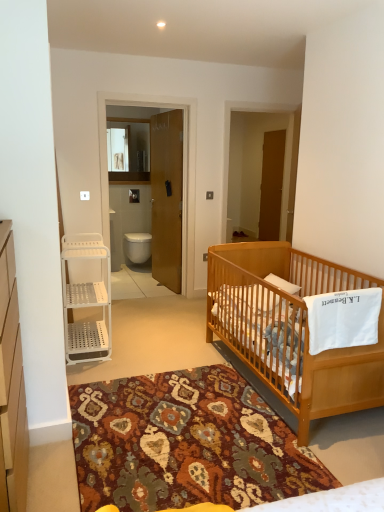
Image resolution: width=384 pixels, height=512 pixels. Find the location of `patterned carpet at center`. patterned carpet at center is located at coordinates (185, 443).

What do you see at coordinates (271, 185) in the screenshot?
I see `brown wooden screen door at center` at bounding box center [271, 185].

In order to face brown wooden door at center, should I rotate leftwards or rightwards?

Rotate left and turn 3.873 degrees.

Where is `patterned carpet at center`? This screenshot has height=512, width=384. patterned carpet at center is located at coordinates [185, 443].

Identify the location of shelf below the brown wooden door at center (from the image's perspective). The image size is (384, 512). (86, 300).

From the image's perspective, is brown wooden door at center positioned above or below white plastic shelf at left?

Based on their image positions, brown wooden door at center is located above white plastic shelf at left.

Which is behind, point (164, 204) or point (64, 242)?

The point (164, 204) is more distant.

Considering the relative sizes of white glossy toilet at center and patterned carpet at center in the image provided, is white glossy toilet at center wider than patterned carpet at center?

In fact, white glossy toilet at center might be narrower than patterned carpet at center.

Can you tell me how much white glossy toilet at center and patterned carpet at center differ in facing direction?

white glossy toilet at center and patterned carpet at center are facing 179 degrees away from each other.

Considering the relative sizes of white glossy toilet at center and patterned carpet at center in the image provided, is white glossy toilet at center smaller than patterned carpet at center?

Correct, white glossy toilet at center occupies less space than patterned carpet at center.

Is patterned carpet at center at the back of white glossy toilet at center?

white glossy toilet at center does not have its back to patterned carpet at center.

From a real-world perspective, is white plastic shelving unit at left positioned over brown wooden door at center based on gravity?

No, from a real-world perspective, white plastic shelving unit at left is not above brown wooden door at center.

Which is more to the left, white plastic shelving unit at left or brown wooden door at center?

From the viewer's perspective, white plastic shelving unit at left appears more on the left side.

How many degrees apart are the facing directions of white plastic shelving unit at left and brown wooden door at center?

172 degrees.

Is white plastic shelving unit at left next to brown wooden door at center?

No, white plastic shelving unit at left is not with brown wooden door at center.

Is light brown wooden crib at lower right looking in the opposite direction of brown wooden door at center?

No, light brown wooden crib at lower right is not facing the opposite direction of brown wooden door at center.

Considering the positions of point (324, 273) and point (169, 266), is point (324, 273) closer or farther from the camera than point (169, 266)?

Clearly, point (324, 273) is closer to the camera than point (169, 266).

From a real-world perspective, relative to brown wooden door at center, is light brown wooden crib at lower right vertically above or below?

In terms of real-world spatial position, light brown wooden crib at lower right is below brown wooden door at center.

Can you confirm if light brown wooden crib at lower right is positioned to the right of brown wooden door at center?

Yes.

Which is behind, brown wooden door at center or brown wooden screen door at center?

brown wooden screen door at center is further from the camera.

Measure the distance between brown wooden door at center and brown wooden screen door at center.

brown wooden door at center and brown wooden screen door at center are 1.89 meters apart from each other.

From their relative heights in the image, would you say brown wooden door at center is taller or shorter than brown wooden screen door at center?

Clearly, brown wooden door at center is taller compared to brown wooden screen door at center.

Is brown wooden door at center looking in the opposite direction of brown wooden screen door at center?

No, brown wooden door at center's orientation is not away from brown wooden screen door at center.

Does white plastic shelving unit at left come in front of white glossy toilet at center?

Yes, it is.

Is white plastic shelving unit at left beside white glossy toilet at center?

They are not placed beside each other.

Is white plastic shelving unit at left to the right of white glossy toilet at center from the viewer's perspective?

In fact, white plastic shelving unit at left is to the left of white glossy toilet at center.

From a real-world perspective, relative to patterned carpet at center, is brown wooden door at center vertically above or below?

In terms of real-world spatial position, brown wooden door at center is above patterned carpet at center.

Is brown wooden door at center bigger or smaller than patterned carpet at center?

In the image, brown wooden door at center appears to be smaller than patterned carpet at center.

Is there a large distance between brown wooden door at center and patterned carpet at center?

Yes, brown wooden door at center is far from patterned carpet at center.

Where is `door on the right side of white plastic shelf at left`? This screenshot has height=512, width=384. door on the right side of white plastic shelf at left is located at coordinates click(167, 197).

This screenshot has height=512, width=384. I want to click on mat located below the white glossy toilet at center (from the image's perspective), so click(185, 443).

Estimate the real-world distances between objects in this image. Which object is further from brown wooden screen door at center, patterned carpet at center or brown wooden door at center?

The object further to brown wooden screen door at center is patterned carpet at center.

Based on their spatial positions, is white plastic shelf at left or brown wooden screen door at center further from white plastic shelving unit at left?

brown wooden screen door at center.

Estimate the real-world distances between objects in this image. Which object is closer to white plastic shelving unit at left, white glossy toilet at center or brown wooden screen door at center?

white glossy toilet at center is positioned closer to the anchor white plastic shelving unit at left.

Looking at the image, which one is located further to brown wooden screen door at center, white plastic shelving unit at left or patterned carpet at center?

white plastic shelving unit at left is further to brown wooden screen door at center.

From the image, which object appears to be farther from brown wooden door at center, white plastic shelving unit at left or patterned carpet at center?

white plastic shelving unit at left.

From the image, which object appears to be farther from white glossy toilet at center, patterned carpet at center or brown wooden screen door at center?

The object further to white glossy toilet at center is patterned carpet at center.

From the image, which object appears to be farther from white glossy toilet at center, white plastic shelving unit at left or patterned carpet at center?

white plastic shelving unit at left is further to white glossy toilet at center.

From the image, which object appears to be farther from light brown wooden crib at lower right, patterned carpet at center or brown wooden door at center?

Based on the image, brown wooden door at center appears to be further to light brown wooden crib at lower right.

Identify the location of mat between white plastic shelving unit at left and white plastic shelf at left in the front-back direction. (185, 443).

At what (x,y) coordinates should I click in order to perform the action: click on shelf between white plastic shelving unit at left and white glossy toilet at center in the front-back direction. Please return your answer as a coordinate pair (x, y). Looking at the image, I should click on (86, 300).

Locate an element on the screen. This screenshot has height=512, width=384. shelf located between white plastic shelving unit at left and brown wooden door at center in the depth direction is located at coordinates (86, 300).

Identify the location of infant bed between white plastic shelving unit at left and white plastic shelf at left along the z-axis. The height and width of the screenshot is (512, 384). 291,329.